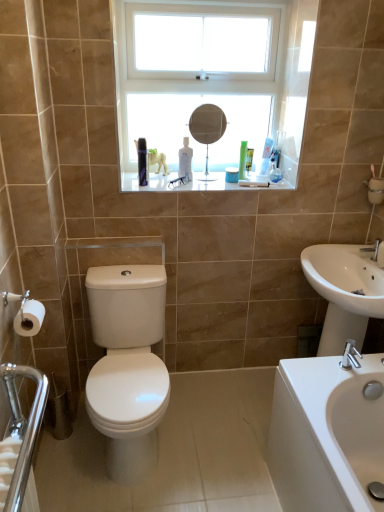
Where is `vacant area to the left of green matte bottle at upper center, the second toiletry viewed from the top`? vacant area to the left of green matte bottle at upper center, the second toiletry viewed from the top is located at coordinates (213, 180).